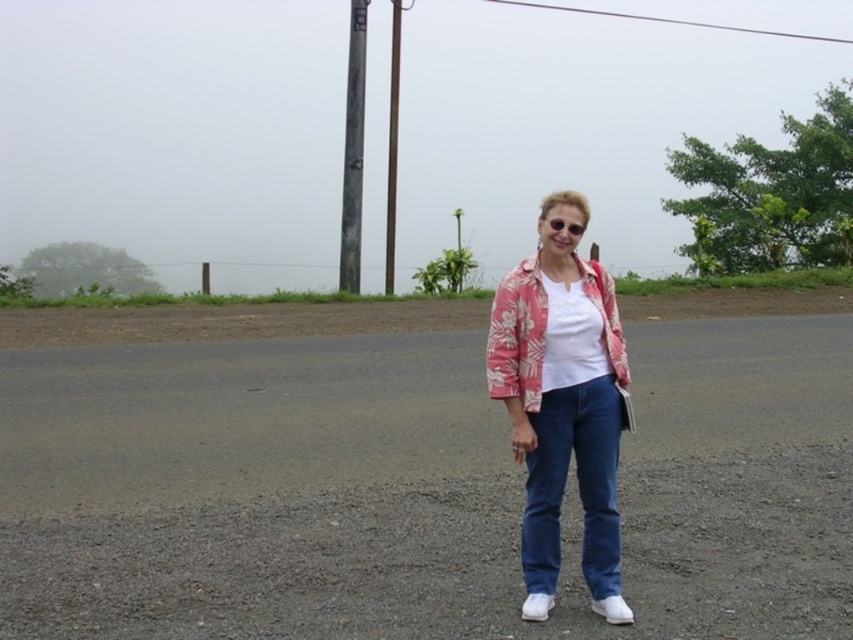
Who is more distant from viewer, (531,531) or (344,163)?

Point (344,163)

Which is in front, point (553, 536) or point (350, 154)?

Point (553, 536)

Between point (595, 557) and point (341, 275), which one is positioned behind?

The point (341, 275) is behind.

The width and height of the screenshot is (853, 640). In order to click on denim jeans at center in this screenshot , I will do `click(577, 484)`.

Consider the image. Is denim jeans at center wider than smooth wood pole at center?

No.

Is point (596, 483) more distant than point (392, 224)?

No, it is in front of (392, 224).

Measure the distance between denim jeans at center and camera.

4.52 meters

You are a GUI agent. You are given a task and a screenshot of the screen. Output one action in this format:
    pyautogui.click(x=<x>, y=<y>)
    Task: Click on the denim jeans at center
    Image resolution: width=853 pixels, height=640 pixels.
    Given the screenshot: What is the action you would take?
    pyautogui.click(x=577, y=484)

The height and width of the screenshot is (640, 853). In order to click on denim jeans at center in this screenshot , I will do `click(577, 484)`.

How far apart are denim jeans at center and floral pink fabric jacket at center?

They are 20.36 inches apart.

You are a GUI agent. You are given a task and a screenshot of the screen. Output one action in this format:
    pyautogui.click(x=<x>, y=<y>)
    Task: Click on the denim jeans at center
    
    Given the screenshot: What is the action you would take?
    pyautogui.click(x=577, y=484)